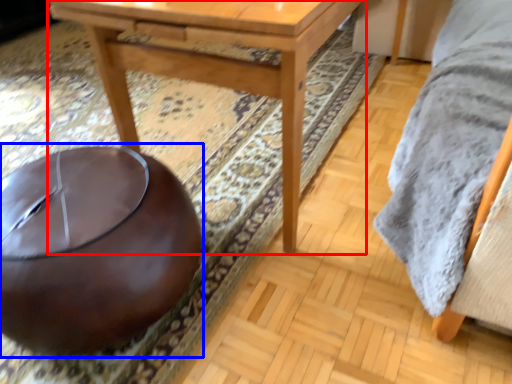
Question: Which object is closer to the camera taking this photo, table (highlighted by a red box) or bean bag chair (highlighted by a blue box)?

Choices:
 (A) table
 (B) bean bag chair

Answer: (B)